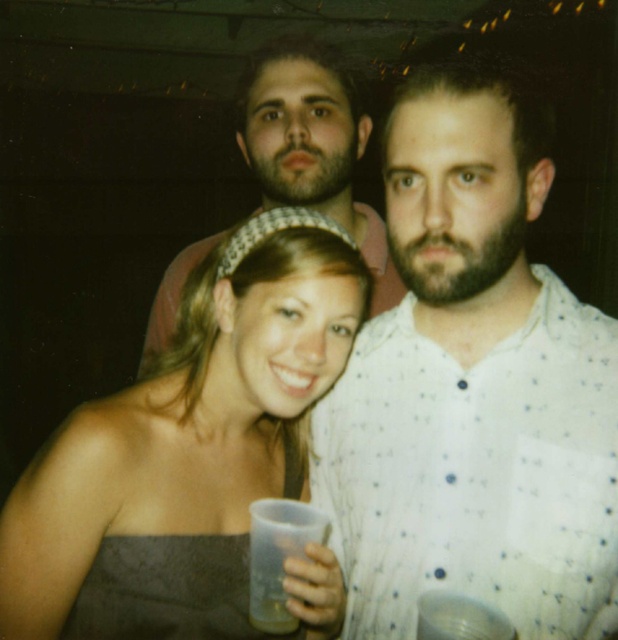
In the scene shown: You are at a party and notice the white dotted shirt at center and the translucent plastic cup at center. Which object is positioned higher in the scene?

The white dotted shirt at center is located above the translucent plastic cup at center, so it is positioned higher.

You are standing in the same room as the three people in the image. You want to move from your current position to the point marked by the coordinate point at (x=263, y=524). However, there is an obstacle at point (x=205, y=284). Can you walk around the obstacle to reach your destination?

Since point (x=205, y=284) is closer to you than point (x=263, y=524), you can walk around the obstacle at point (x=205, y=284) to reach the destination at point (x=263, y=524).

You are at a party and see the white dotted shirt at center. If you want to hand a drink to the person wearing it without moving closer, can you reach them from your current position?

The white dotted shirt at center and viewer are 30.07 inches apart. Since 30.07 inches is roughly 2.5 feet, you can likely reach them without moving closer as most people can extend their arms about 2 feet or more.